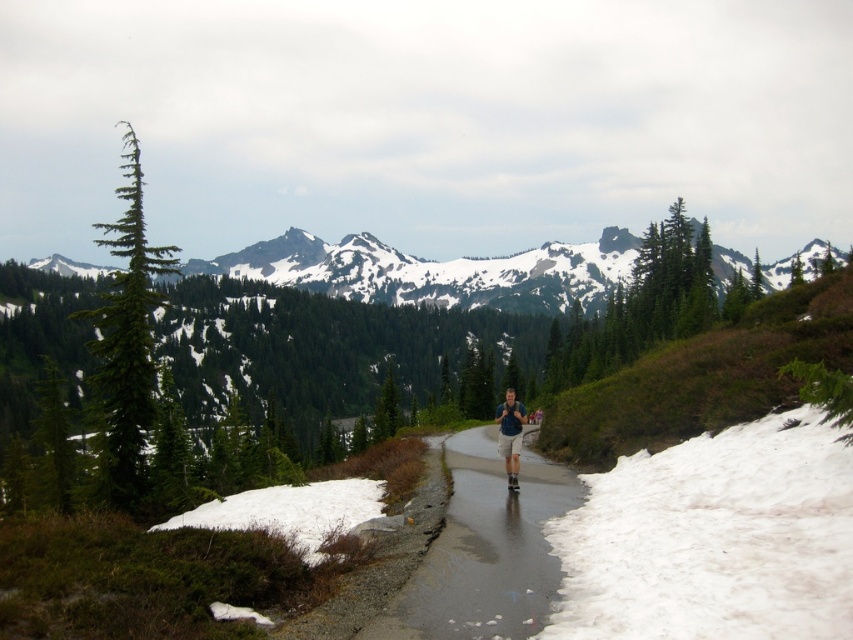
Can you confirm if white fluffy snow at lower left is positioned above blue fabric shirt at center?

Incorrect, white fluffy snow at lower left is not positioned above blue fabric shirt at center.

Can you confirm if white fluffy snow at lower left is taller than blue fabric shirt at center?

In fact, white fluffy snow at lower left may be shorter than blue fabric shirt at center.

Is point (180, 524) behind point (502, 429)?

Yes, point (180, 524) is behind point (502, 429).

I want to click on white fluffy snow at lower left, so click(291, 512).

Does green forested mountain at upper center lie in front of white fluffy snow at lower left?

No, it is not.

Where is `green forested mountain at upper center`? green forested mountain at upper center is located at coordinates (436, 272).

At what (x,y) coordinates should I click in order to perform the action: click on green forested mountain at upper center. Please return your answer as a coordinate pair (x, y). Looking at the image, I should click on (x=436, y=272).

Is shiny asphalt road at center bigger than blue fabric shirt at center?

Indeed, shiny asphalt road at center has a larger size compared to blue fabric shirt at center.

Does shiny asphalt road at center appear on the right side of blue fabric shirt at center?

In fact, shiny asphalt road at center is to the left of blue fabric shirt at center.

Does point (459, 449) lie in front of point (503, 429)?

No.

Locate an element on the screen. Image resolution: width=853 pixels, height=640 pixels. shiny asphalt road at center is located at coordinates (485, 552).